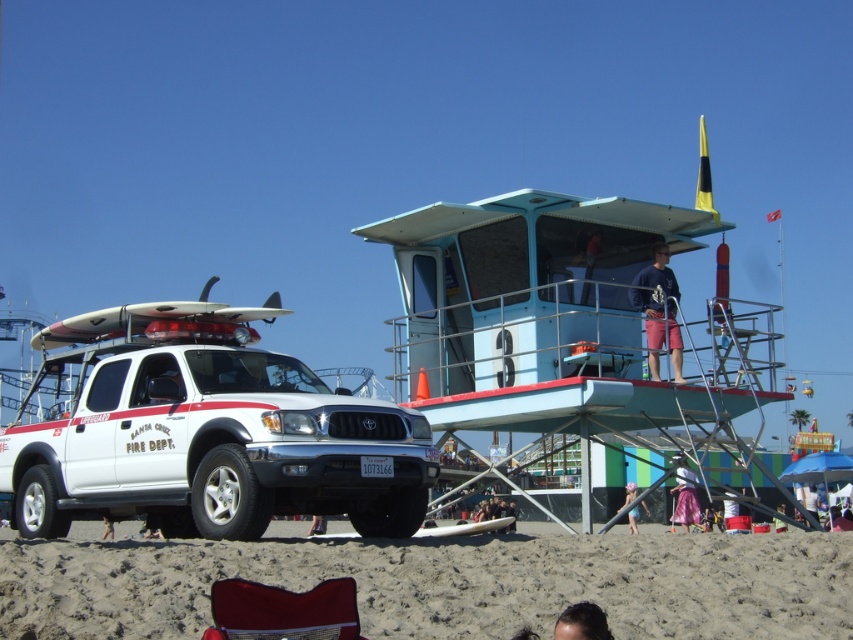
Which of these two, brown sandy beach at lower center or velvet red beach chair at lower center, stands shorter?

Standing shorter between the two is velvet red beach chair at lower center.

Does point (448, 588) come behind point (347, 580)?

Yes, it is.

Where is `brown sandy beach at lower center`? brown sandy beach at lower center is located at coordinates (444, 582).

Identify the location of dark blue shirt at center. The image size is (853, 640). (659, 308).

Is dark blue shirt at center bigger than pink satin skirt at lower right?

No.

Is point (665, 280) positioned before point (689, 513)?

Yes.

The image size is (853, 640). Identify the location of dark blue shirt at center. (x=659, y=308).

Does dark brown hair at lower center have a greater width compared to pink satin skirt at lower right?

No, dark brown hair at lower center is not wider than pink satin skirt at lower right.

Who is positioned more to the right, dark brown hair at lower center or pink satin skirt at lower right?

pink satin skirt at lower right is more to the right.

What do you see at coordinates (581, 621) in the screenshot?
I see `dark brown hair at lower center` at bounding box center [581, 621].

Locate an element on the screen. dark brown hair at lower center is located at coordinates (581, 621).